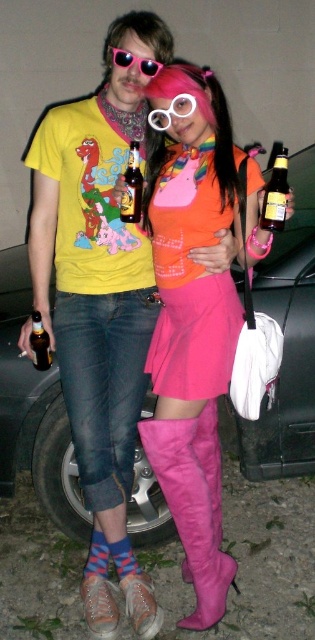
You are standing at the camera position and want to throw a small ball to a friend who is at point (x=179, y=196). If you can throw the ball up to 6 feet, will you be able to reach them?

The distance between you and point (x=179, y=196) is 6.64 feet, which is beyond your throwing range of 6 feet. Therefore, you won not be able to reach them with the ball.

You are a photographer trying to capture a closeup shot of the pink suede boots at lower center and the pink suede boot at lower center. Which one is positioned more to the right side?

The pink suede boots at lower center is positioned more to the right side than the pink suede boot at lower center.

You are a photographer setting up for a photoshoot. You have a pink satin dress at center and a translucent glass bottle at lower left. The client wants to know if the distance between them is less than 25 inches so they can adjust the camera angle. Can you confirm?

The pink satin dress at center is 24.98 inches away from the translucent glass bottle at lower left, which is just under 25 inches. This means the distance between them is indeed less than 25 inches, so the client can proceed with adjusting the camera angle accordingly.